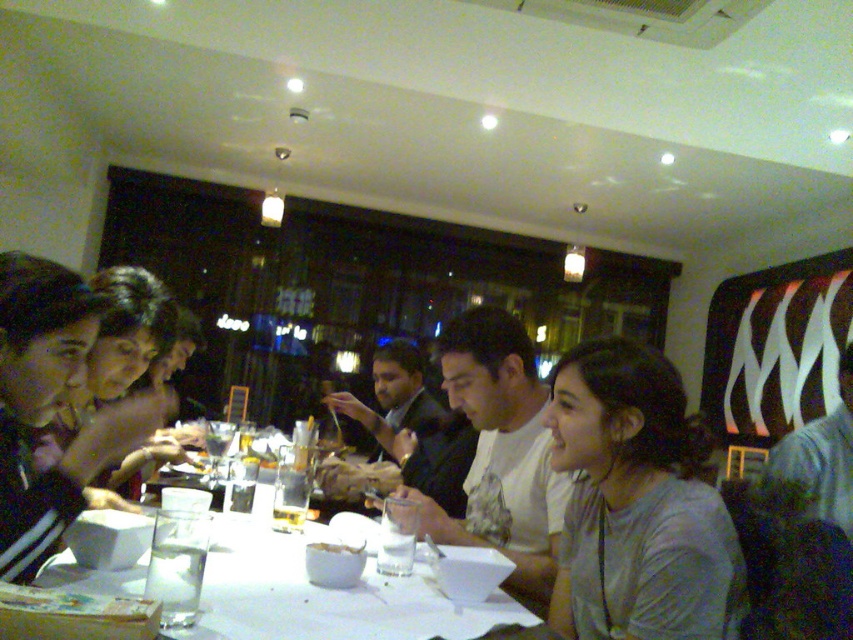
Question: Where is white matte shirt at center located in relation to dark gray shirt at center in the image?

Choices:
 (A) right
 (B) left

Answer: (A)

Question: Which object is closer to the camera taking this photo?

Choices:
 (A) denim shirt at lower right
 (B) gray matte shirt at center
 (C) white matte bowl at center
 (D) matte black shirt at center

Answer: (D)

Question: Which point is closer to the camera?

Choices:
 (A) white matte bowl at center
 (B) matte black shirt at center
 (C) white paper table at center
 (D) gray matte shirt at center

Answer: (C)

Question: Does white matte shirt at center have a lesser width compared to dark gray shirt at center?

Choices:
 (A) yes
 (B) no

Answer: (A)

Question: Which point is farther to the camera?

Choices:
 (A) (345, 554)
 (B) (431, 460)

Answer: (B)

Question: Can you confirm if matte black shirt at center is positioned below white paper table at center?

Choices:
 (A) no
 (B) yes

Answer: (A)